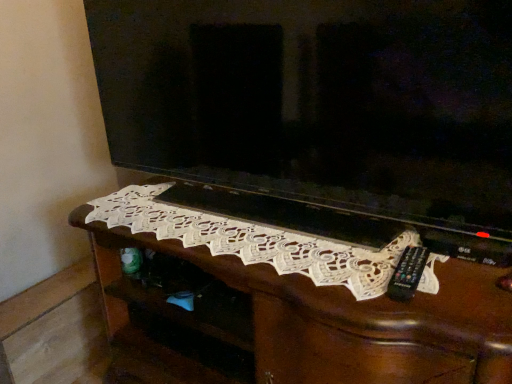
Identify the location of free area below white lace doily at center (from a real-world perspective). The height and width of the screenshot is (384, 512). (217, 236).